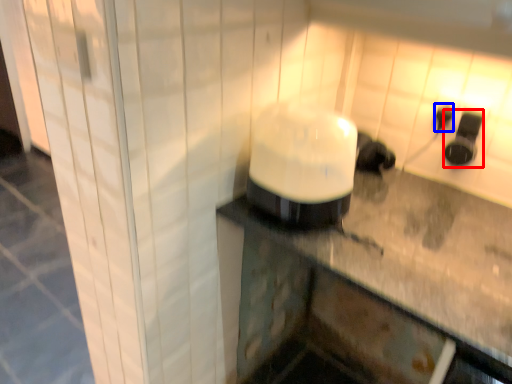
Question: Which object appears closest to the camera in this image, appliance (highlighted by a red box) or electric outlet (highlighted by a blue box)?

Choices:
 (A) appliance
 (B) electric outlet

Answer: (A)